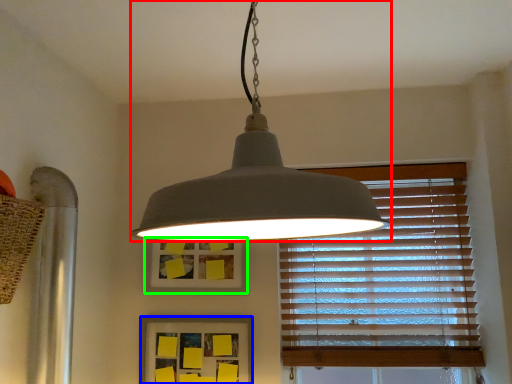
Question: Estimate the real-world distances between objects in this image. Which object is farther from lamp (highlighted by a red box), picture frame (highlighted by a blue box) or picture frame (highlighted by a green box)?

Choices:
 (A) picture frame
 (B) picture frame

Answer: (A)